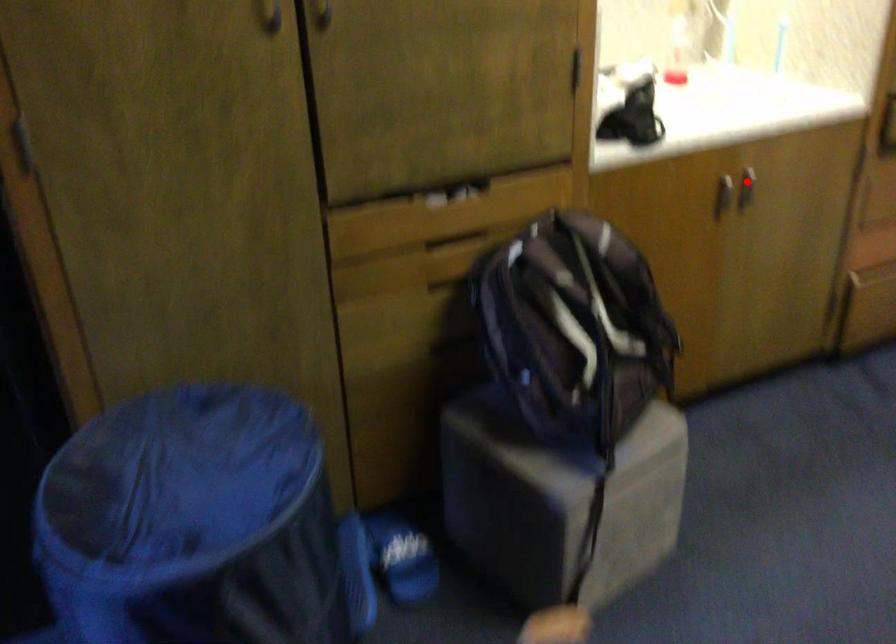
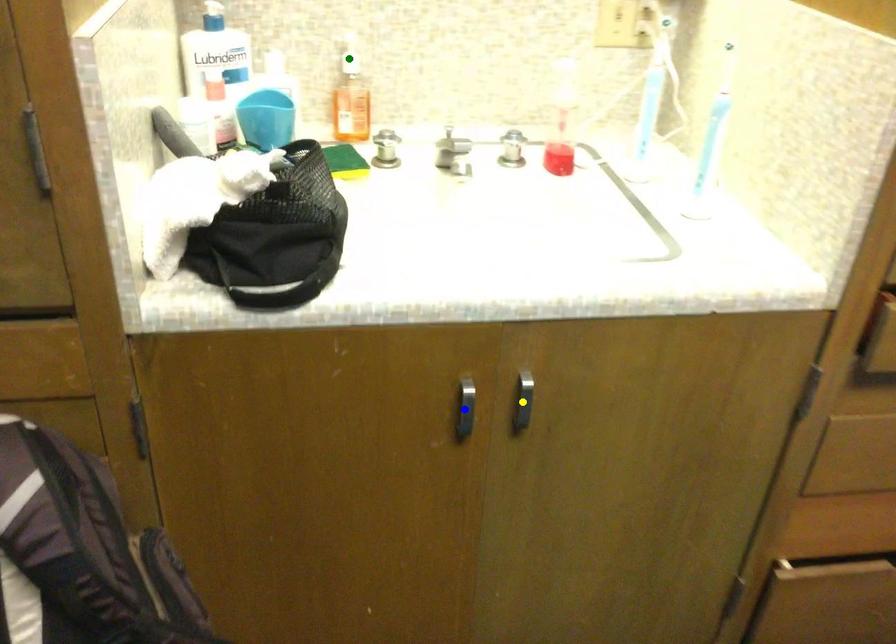
Question: I am providing you with two images of the same scene from different viewpoints. A red point is marked on the first image. You are given multiple points on the second image. Which mark in image 2 goes with the point in image 1?

Choices:
 (A) blue point
 (B) yellow point
 (C) green point

Answer: (B)